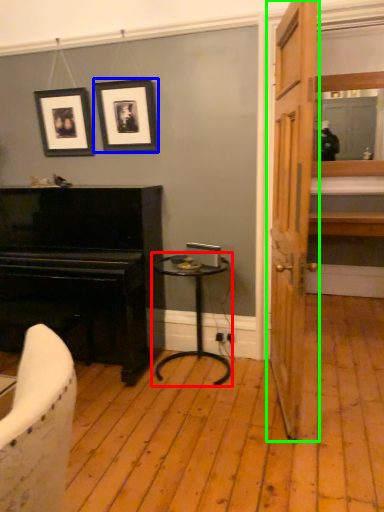
Question: Which object is positioned closest to table (highlighted by a red box)? Select from picture frame (highlighted by a blue box) and door (highlighted by a green box).

Choices:
 (A) picture frame
 (B) door

Answer: (B)